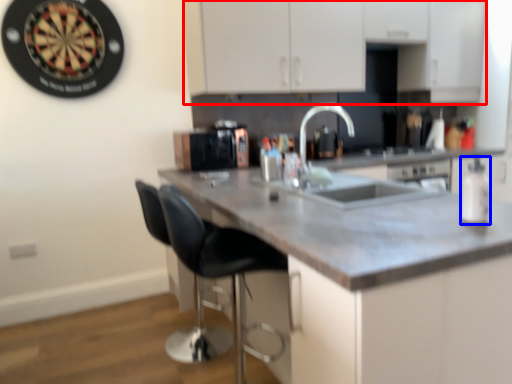
Question: Which object is closer to the camera taking this photo, cabinetry (highlighted by a red box) or bottle (highlighted by a blue box)?

Choices:
 (A) cabinetry
 (B) bottle

Answer: (B)